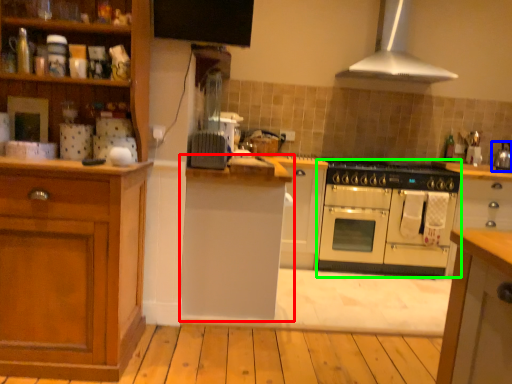
Question: Which object is the closest to the cabinetry (highlighted by a red box)? Choose among these: kitchen appliance (highlighted by a blue box) or oven (highlighted by a green box).

Choices:
 (A) kitchen appliance
 (B) oven

Answer: (B)